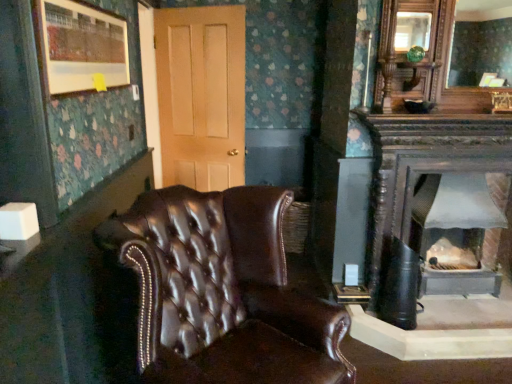
Identify the location of free space above light brown wood door at center (from a real-world perspective). Image resolution: width=512 pixels, height=384 pixels. (201, 8).